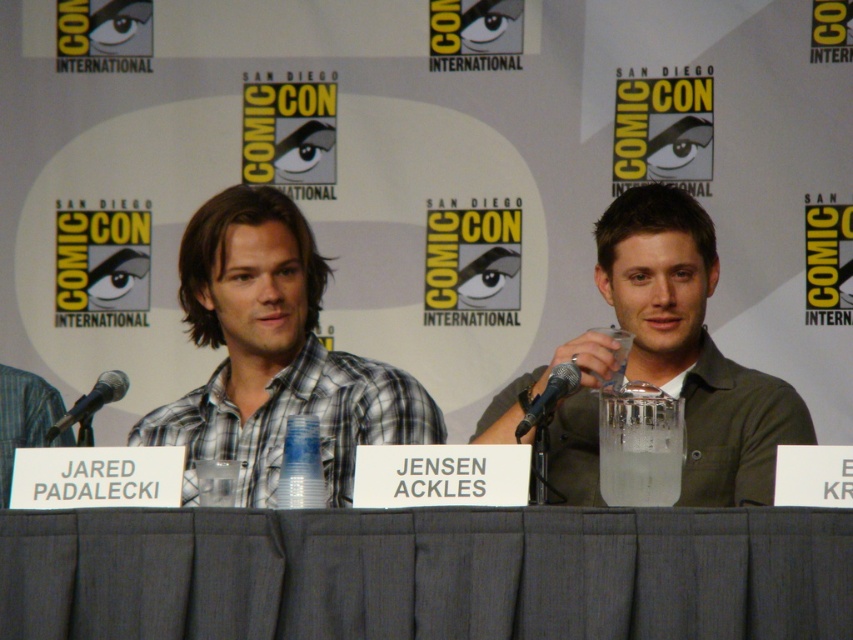
Question: Which object appears farthest from the camera in this image?

Choices:
 (A) black metallic microphone at center
 (B) clear glass cup at center

Answer: (A)

Question: Is the position of clear glass cup at center less distant than that of black metallic microphone at center?

Choices:
 (A) no
 (B) yes

Answer: (B)

Question: Can you confirm if gray fabric table at center is wider than black metallic microphone at center?

Choices:
 (A) yes
 (B) no

Answer: (A)

Question: Considering the real-world distances, which object is closest to the black metallic microphone at center?

Choices:
 (A) plaid cotton shirt at center
 (B) gray fabric table at center
 (C) clear glass cup at center

Answer: (C)

Question: Estimate the real-world distances between objects in this image. Which object is closer to the black metallic microphone at center?

Choices:
 (A) clear glass cup at center
 (B) plaid cotton shirt at center

Answer: (A)

Question: Does matte green shirt at center have a lesser width compared to black metallic microphone at center?

Choices:
 (A) yes
 (B) no

Answer: (B)